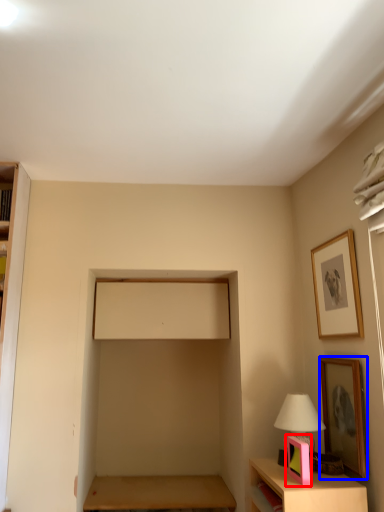
Question: Which of the following is the closest to the observer, picture frame (highlighted by a red box) or picture frame (highlighted by a blue box)?

Choices:
 (A) picture frame
 (B) picture frame

Answer: (A)